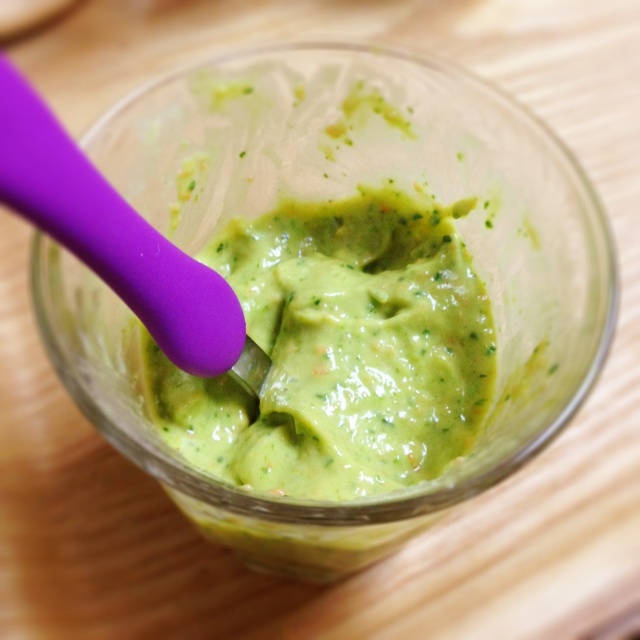
Which of these two, green creamy guacamole at center or purple silicone spoon at center, stands shorter?

Standing shorter between the two is purple silicone spoon at center.

Can you confirm if green creamy guacamole at center is bigger than purple silicone spoon at center?

Indeed, green creamy guacamole at center has a larger size compared to purple silicone spoon at center.

I want to click on green creamy guacamole at center, so click(340, 349).

Locate an element on the screen. green creamy guacamole at center is located at coordinates (340, 349).